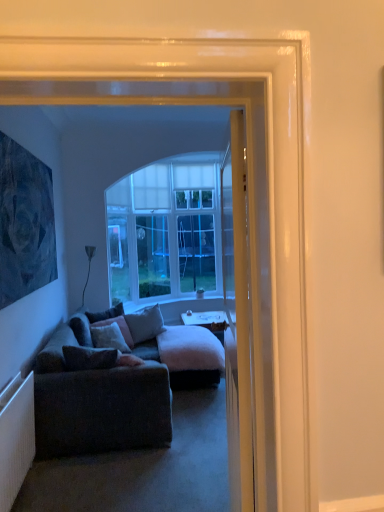
Question: Looking at their shapes, would you say white textured radiator at lower left is wider or thinner than white glossy door at center?

Choices:
 (A) thin
 (B) wide

Answer: (A)

Question: Is white textured radiator at lower left taller or shorter than white glossy door at center?

Choices:
 (A) tall
 (B) short

Answer: (B)

Question: Estimate the real-world distances between objects in this image. Which object is farther from the velvet gray pillow at center, which is the first pillow in front-to-back order?

Choices:
 (A) dark gray fabric couch at lower left
 (B) dark blue textured painting at upper left
 (C) white glossy desk at center
 (D) white textured radiator at lower left
 (E) velvet gray pillow at center, which is the 1th pillow from back to front

Answer: (C)

Question: Which is farther from the velvet gray pillow at center, which is the first pillow in front-to-back order?

Choices:
 (A) white textured radiator at lower left
 (B) gray fabric pillow at center, the second pillow viewed from the back
 (C) velvet cushion at center, the third pillow in the back-to-front sequence
 (D) dark blue textured painting at upper left
 (E) velvet gray pillow at center, which is counted as the fourth pillow, starting from the front

Answer: (B)